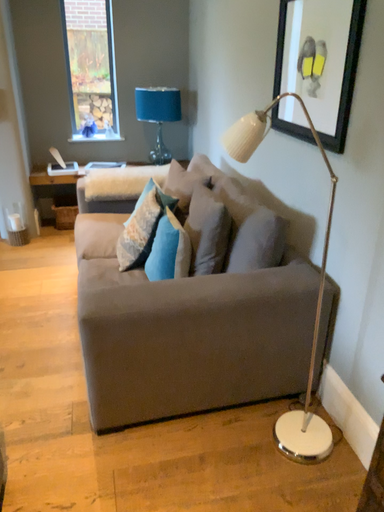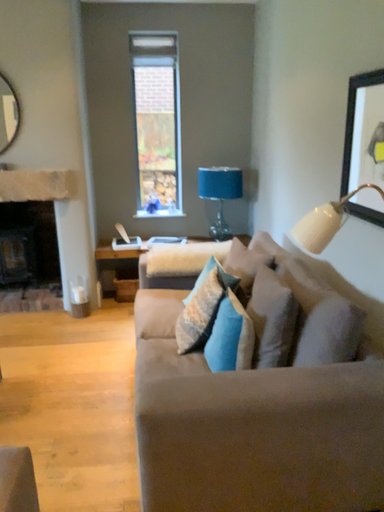
Question: Which way did the camera rotate in the video?

Choices:
 (A) rotated upward
 (B) rotated downward

Answer: (A)